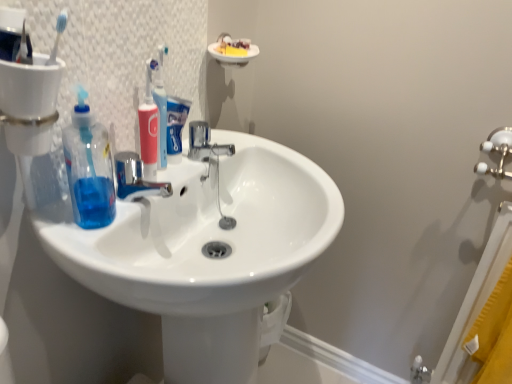
Measure the distance between chrome metallic faucet at center and camera.

The depth of chrome metallic faucet at center is 33.80 inches.

I want to click on chrome metallic faucet at center, so click(205, 143).

In order to face white glossy sink at center, should I rotate leftwards or rightwards?

Turn left by 5.001 degrees to look at white glossy sink at center.

What do you see at coordinates (206, 252) in the screenshot?
I see `white glossy sink at center` at bounding box center [206, 252].

Measure the distance between blue matte toothpaste at center and camera.

blue matte toothpaste at center is 77.20 centimeters away from camera.

What do you see at coordinates (176, 126) in the screenshot? Image resolution: width=512 pixels, height=384 pixels. I see `blue matte toothpaste at center` at bounding box center [176, 126].

Where is `pink plastic toothbrush at center`? This screenshot has width=512, height=384. pink plastic toothbrush at center is located at coordinates (149, 127).

Identify the location of chrome metallic faucet at center. (205, 143).

Can you confirm if pink plastic toothbrush at center is wider than blue matte toothpaste at center?

Correct, the width of pink plastic toothbrush at center exceeds that of blue matte toothpaste at center.

Considering the sizes of objects pink plastic toothbrush at center and blue matte toothpaste at center in the image provided, who is bigger, pink plastic toothbrush at center or blue matte toothpaste at center?

blue matte toothpaste at center is bigger.

Is the position of pink plastic toothbrush at center more distant than that of blue matte toothpaste at center?

No, the depth of pink plastic toothbrush at center is less than that of blue matte toothpaste at center.

Can you confirm if pink plastic toothbrush at center is positioned to the left of blue matte toothpaste at center?

Yes.

Find the location of a particular element. mirror in front of the transparent blue liquid at sink left is located at coordinates (122, 52).

From the picture: Is transparent blue liquid at sink left oriented away from transparent plastic toothbrushes at upper left?

Yes, transparent blue liquid at sink left is facing away from transparent plastic toothbrushes at upper left.

Is transparent plastic toothbrushes at upper left completely or partially inside transparent blue liquid at sink left?

Definitely not — transparent plastic toothbrushes at upper left is not inside transparent blue liquid at sink left.

From a real-world perspective, is transparent blue liquid at sink left under transparent plastic toothbrushes at upper left?

Indeed, from a real-world perspective, transparent blue liquid at sink left is positioned beneath transparent plastic toothbrushes at upper left.

Is blue matte toothpaste at center facing towards chrome metallic faucet at center?

No, blue matte toothpaste at center is not facing towards chrome metallic faucet at center.

Which is nearer, (x=179, y=145) or (x=201, y=150)?

The point (x=179, y=145) is in front.

In the scene shown: Is chrome metallic faucet at center surrounded by blue matte toothpaste at center?

No, chrome metallic faucet at center is not surrounded by blue matte toothpaste at center.

Consider the image. From the image's perspective, which is below, blue matte toothpaste at center or chrome metallic faucet at center?

chrome metallic faucet at center appears lower in the image.

From the image's perspective, is pink plastic toothbrush at center positioned above or below transparent plastic toothbrushes at upper left?

Clearly, from the image's perspective, pink plastic toothbrush at center is below transparent plastic toothbrushes at upper left.

Does pink plastic toothbrush at center have a lesser width compared to transparent plastic toothbrushes at upper left?

No, pink plastic toothbrush at center is not thinner than transparent plastic toothbrushes at upper left.

Does pink plastic toothbrush at center turn towards transparent plastic toothbrushes at upper left?

No, pink plastic toothbrush at center is not turned towards transparent plastic toothbrushes at upper left.

Which of these two, pink plastic toothbrush at center or transparent plastic toothbrushes at upper left, is smaller?

With smaller size is pink plastic toothbrush at center.

From a real-world perspective, is white glossy sink at center positioned over transparent plastic toothbrushes at upper left based on gravity?

Incorrect, from a real-world perspective, white glossy sink at center is lower than transparent plastic toothbrushes at upper left.

Is white glossy sink at center beside transparent plastic toothbrushes at upper left?

No, white glossy sink at center is not touching transparent plastic toothbrushes at upper left.

Which object is thinner, white glossy sink at center or transparent plastic toothbrushes at upper left?

With smaller width is transparent plastic toothbrushes at upper left.

From a real-world perspective, which object stands above the other?

transparent blue liquid at sink left is physically above.

Is transparent blue liquid at sink left at the right side of chrome metallic faucet at center?

No.

Does point (77, 93) appear closer or farther from the camera than point (195, 152)?

Clearly, point (77, 93) is closer to the camera than point (195, 152).

Which of these two, transparent blue liquid at sink left or chrome metallic faucet at center, is wider?

chrome metallic faucet at center is wider.

Considering the sizes of transparent blue liquid at sink left and pink plastic toothbrush at center in the image, is transparent blue liquid at sink left taller or shorter than pink plastic toothbrush at center?

In the image, transparent blue liquid at sink left appears to be shorter than pink plastic toothbrush at center.

Does point (72, 162) come behind point (151, 145)?

No, (72, 162) is closer to viewer.

Looking at this image, from the image's perspective, between transparent blue liquid at sink left and pink plastic toothbrush at center, who is located below?

From the image's view, transparent blue liquid at sink left is below.

This screenshot has width=512, height=384. What are the coordinates of `toothpaste to the right of pink plastic toothbrush at center` in the screenshot? It's located at (176, 126).

At what (x,y) coordinates should I click in order to perform the action: click on cleaning product that appears below the transparent plastic toothbrushes at upper left (from the image's perspective). Please return your answer as a coordinate pair (x, y). This screenshot has width=512, height=384. Looking at the image, I should click on (89, 167).

From the image, which object appears to be farther from pink plastic toothbrush at center, transparent plastic toothbrushes at upper left or transparent blue liquid at sink left?

Based on the image, transparent blue liquid at sink left appears to be further to pink plastic toothbrush at center.

From the image, which object appears to be farther from transparent blue liquid at sink left, white glossy sink at center or chrome metallic faucet at center?

chrome metallic faucet at center is further to transparent blue liquid at sink left.

Based on their spatial positions, is transparent plastic toothbrushes at upper left or white glossy sink at center further from chrome metallic faucet at center?

white glossy sink at center lies further to chrome metallic faucet at center than the other object.

Which object lies further to the anchor point transparent plastic toothbrushes at upper left, chrome metallic faucet at center or blue matte toothpaste at center?

chrome metallic faucet at center.

When comparing their distances from pink plastic toothbrush at center, does chrome metallic faucet at center or blue matte toothpaste at center seem closer?

Based on the image, blue matte toothpaste at center appears to be nearer to pink plastic toothbrush at center.

Based on their spatial positions, is pink plastic toothbrush at center or chrome metallic faucet at center closer to white glossy sink at center?

chrome metallic faucet at center lies closer to white glossy sink at center than the other object.

Which object lies further to the anchor point transparent plastic toothbrushes at upper left, pink plastic toothbrush at center or blue matte toothpaste at center?

blue matte toothpaste at center is further to transparent plastic toothbrushes at upper left.

Looking at the image, which one is located further to transparent blue liquid at sink left, transparent plastic toothbrushes at upper left or chrome metallic faucet at center?

chrome metallic faucet at center is positioned further to the anchor transparent blue liquid at sink left.

Where is `toiletry between transparent plastic toothbrushes at upper left and blue matte toothpaste at center in the front-back direction`? toiletry between transparent plastic toothbrushes at upper left and blue matte toothpaste at center in the front-back direction is located at coordinates (149, 127).

Where is `cleaning product that lies between transparent plastic toothbrushes at upper left and white glossy sink at center from top to bottom`? This screenshot has width=512, height=384. cleaning product that lies between transparent plastic toothbrushes at upper left and white glossy sink at center from top to bottom is located at coordinates point(89,167).

Locate an element on the screen. cleaning product between transparent plastic toothbrushes at upper left and chrome metallic faucet at center in the front-back direction is located at coordinates (89, 167).

Where is `toothpaste between transparent plastic toothbrushes at upper left and chrome metallic faucet at center from front to back`? Image resolution: width=512 pixels, height=384 pixels. toothpaste between transparent plastic toothbrushes at upper left and chrome metallic faucet at center from front to back is located at coordinates (176, 126).